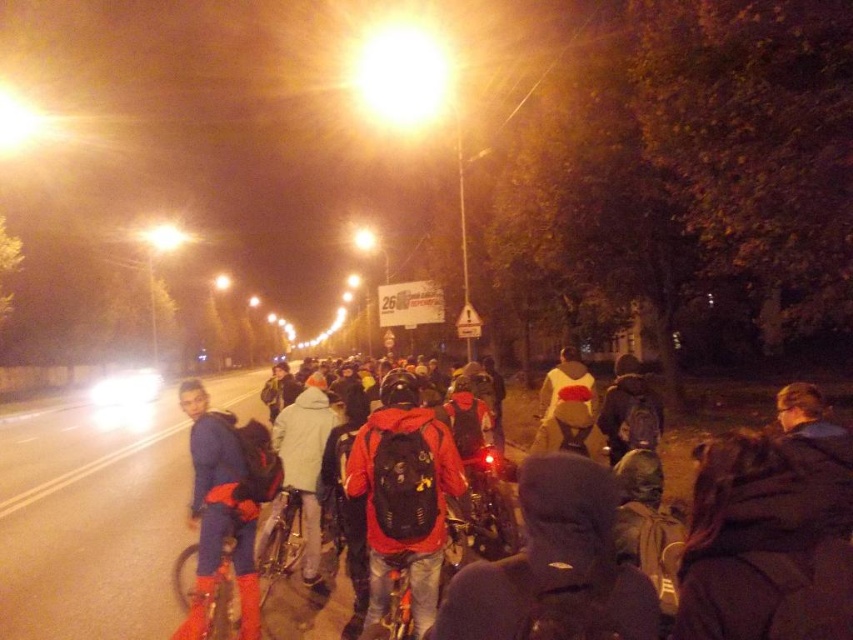
Looking at this image, you are a delivery person who needs to hand a package to the person wearing the matte red jacket at center and the blue fabric jacket at left. If you are standing at the starting point, which jacket is closer to you?

The matte red jacket at center is 4.13 feet away from the blue fabric jacket at left. Therefore, the blue fabric jacket at left is closer to you since it is only 4.13 feet away from the matte red jacket at center, but without knowing the exact distance from your starting point, it is impossible to determine which is closer.

You are standing at the camera position and want to move towards the two points marked in the image. Which point, point [585,621] or point [445,433], will you reach first?

Point [585,621] is closer to the camera than point [445,433], so you will reach point [585,621] first.

You are a photographer standing on the road and want to take a photo of the red backpack at center and the matte red jacket at center. Which object should you focus on first if you want to capture both in sharp focus?

The red backpack at center is located above the matte red jacket at center. Since they are at different heights, you can focus on the matte red jacket at center first as it is closer, ensuring both will be in focus when using a shallow depth of field.